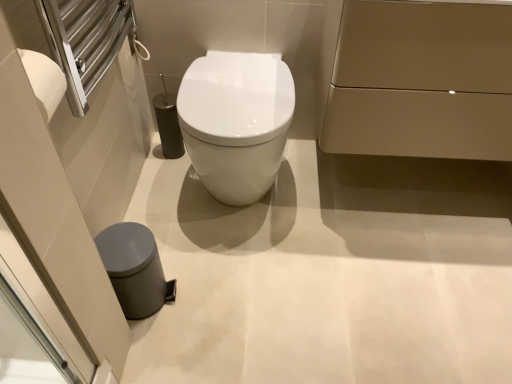
Find the location of a particular element. matte gold cabinet at upper right, acting as the second porcelain starting from the bottom is located at coordinates (419, 79).

How much space does matte gold cabinet at upper right, positioned as the 1th porcelain in right-to-left order, occupy horizontally?

matte gold cabinet at upper right, positioned as the 1th porcelain in right-to-left order, is 44.54 centimeters in width.

Where is `matte gold cabinet at upper right, positioned as the 1th porcelain in right-to-left order`? The height and width of the screenshot is (384, 512). matte gold cabinet at upper right, positioned as the 1th porcelain in right-to-left order is located at coordinates (419, 79).

How different are the orientations of gray matte trash can at lower left, the 1th porcelain viewed from the left, and white glossy toilet at center in degrees?

There is a 89.5-degree angle between the facing directions of gray matte trash can at lower left, the 1th porcelain viewed from the left, and white glossy toilet at center.

Do you think gray matte trash can at lower left, the second porcelain when ordered from right to left, is within white glossy toilet at center, or outside of it?

gray matte trash can at lower left, the second porcelain when ordered from right to left, is not inside white glossy toilet at center, it's outside.

The height and width of the screenshot is (384, 512). I want to click on toilet above the gray matte trash can at lower left, the 1th porcelain viewed from the left (from the image's perspective), so click(236, 121).

Is gray matte trash can at lower left, which is the 1th porcelain from bottom to top, bigger than white glossy toilet at center?

Actually, gray matte trash can at lower left, which is the 1th porcelain from bottom to top, might be smaller than white glossy toilet at center.

Does white glossy toilet at center lie behind gray matte trash can at lower left, the second porcelain when ordered from right to left?

Yes, it is.

Is gray matte trash can at lower left, arranged as the second porcelain when viewed from the top, surrounded by white glossy toilet at center?

That's incorrect, gray matte trash can at lower left, arranged as the second porcelain when viewed from the top, is not inside white glossy toilet at center.

Is white glossy toilet at center not close to gray matte trash can at lower left, arranged as the second porcelain when viewed from the top?

No, white glossy toilet at center is in close proximity to gray matte trash can at lower left, arranged as the second porcelain when viewed from the top.

In terms of height, does white glossy toilet at center look taller or shorter compared to gray matte trash can at lower left, arranged as the second porcelain when viewed from the top?

Clearly, white glossy toilet at center is taller compared to gray matte trash can at lower left, arranged as the second porcelain when viewed from the top.

From the image's perspective, is white glossy toilet at center located above matte gold cabinet at upper right, acting as the 1th porcelain starting from the top?

Incorrect, from the image's perspective, white glossy toilet at center is lower than matte gold cabinet at upper right, acting as the 1th porcelain starting from the top.

Is point (234, 86) closer or farther from the camera than point (457, 143)?

Point (234, 86) is positioned farther from the camera compared to point (457, 143).

From their relative heights in the image, would you say white glossy toilet at center is taller or shorter than matte gold cabinet at upper right, positioned as the 1th porcelain in right-to-left order?

white glossy toilet at center is shorter than matte gold cabinet at upper right, positioned as the 1th porcelain in right-to-left order.

Choose the correct answer: Is white glossy toilet at center inside matte gold cabinet at upper right, acting as the 1th porcelain starting from the top, or outside it?

white glossy toilet at center is not inside matte gold cabinet at upper right, acting as the 1th porcelain starting from the top, it's outside.

Is matte gold cabinet at upper right, positioned as the 1th porcelain in right-to-left order, looking in the opposite direction of gray matte trash can at lower left, the 1th porcelain viewed from the left?

No, matte gold cabinet at upper right, positioned as the 1th porcelain in right-to-left order,'s orientation is not away from gray matte trash can at lower left, the 1th porcelain viewed from the left.

Who is bigger, matte gold cabinet at upper right, positioned as the 1th porcelain in right-to-left order, or gray matte trash can at lower left, the 1th porcelain viewed from the left?

Bigger between the two is matte gold cabinet at upper right, positioned as the 1th porcelain in right-to-left order.

Visually, is matte gold cabinet at upper right, acting as the 1th porcelain starting from the top, positioned to the left or to the right of gray matte trash can at lower left, the 1th porcelain viewed from the left?

matte gold cabinet at upper right, acting as the 1th porcelain starting from the top, is positioned on gray matte trash can at lower left, the 1th porcelain viewed from the left,'s right side.

What are the coordinates of `porcelain in front of the gray matte trash can at lower left, arranged as the second porcelain when viewed from the top` in the screenshot? It's located at (419, 79).

From the image's perspective, is gray matte trash can at lower left, the second porcelain when ordered from right to left, below matte gold cabinet at upper right, acting as the 1th porcelain starting from the top?

Indeed, from the image's perspective, gray matte trash can at lower left, the second porcelain when ordered from right to left, is shown beneath matte gold cabinet at upper right, acting as the 1th porcelain starting from the top.

Is gray matte trash can at lower left, the second porcelain when ordered from right to left, surrounding matte gold cabinet at upper right, acting as the second porcelain starting from the bottom?

No, matte gold cabinet at upper right, acting as the second porcelain starting from the bottom, is not surrounded by gray matte trash can at lower left, the second porcelain when ordered from right to left.

Looking at their sizes, would you say gray matte trash can at lower left, the 1th porcelain viewed from the left, is wider or thinner than matte gold cabinet at upper right, acting as the second porcelain starting from the bottom?

In the image, gray matte trash can at lower left, the 1th porcelain viewed from the left, appears to be more narrow than matte gold cabinet at upper right, acting as the second porcelain starting from the bottom.

From a real-world perspective, who is located lower, gray matte trash can at lower left, arranged as the second porcelain when viewed from the top, or matte gold cabinet at upper right, acting as the 1th porcelain starting from the top?

From a 3D spatial view, gray matte trash can at lower left, arranged as the second porcelain when viewed from the top, is below.

From a real-world perspective, does matte gold cabinet at upper right, acting as the 1th porcelain starting from the top, stand above white glossy toilet at center?

Yes, from a real-world perspective, matte gold cabinet at upper right, acting as the 1th porcelain starting from the top, is above white glossy toilet at center.

Which is nearer, (477, 120) or (244, 132)?

Positioned in front is point (244, 132).

From the picture: From the image's perspective, between matte gold cabinet at upper right, acting as the second porcelain starting from the bottom, and white glossy toilet at center, who is located below?

white glossy toilet at center, from the image's perspective.

The width and height of the screenshot is (512, 384). I want to click on porcelain above the white glossy toilet at center (from the image's perspective), so click(419, 79).

Locate an element on the screen. toilet that appears on the right of gray matte trash can at lower left, the second porcelain when ordered from right to left is located at coordinates (236, 121).

Where is `toilet that is behind the gray matte trash can at lower left, arranged as the second porcelain when viewed from the top`? This screenshot has width=512, height=384. toilet that is behind the gray matte trash can at lower left, arranged as the second porcelain when viewed from the top is located at coordinates (236, 121).

Considering their positions, is matte gold cabinet at upper right, the 2th porcelain from the left, positioned closer to white glossy toilet at center than gray matte trash can at lower left, the 1th porcelain viewed from the left?

The object closer to white glossy toilet at center is matte gold cabinet at upper right, the 2th porcelain from the left.

When comparing their distances from matte gold cabinet at upper right, the 2th porcelain from the left, does gray matte trash can at lower left, which is the 1th porcelain from bottom to top, or white glossy toilet at center seem further?

gray matte trash can at lower left, which is the 1th porcelain from bottom to top, lies further to matte gold cabinet at upper right, the 2th porcelain from the left, than the other object.

Based on their spatial positions, is gray matte trash can at lower left, which is the 1th porcelain from bottom to top, or matte gold cabinet at upper right, the 2th porcelain from the left, closer to white glossy toilet at center?

matte gold cabinet at upper right, the 2th porcelain from the left, lies closer to white glossy toilet at center than the other object.

Estimate the real-world distances between objects in this image. Which object is closer to matte gold cabinet at upper right, acting as the 1th porcelain starting from the top, white glossy toilet at center or gray matte trash can at lower left, the 1th porcelain viewed from the left?

white glossy toilet at center is positioned closer to the anchor matte gold cabinet at upper right, acting as the 1th porcelain starting from the top.

When comparing their distances from gray matte trash can at lower left, the 1th porcelain viewed from the left, does white glossy toilet at center or matte gold cabinet at upper right, positioned as the 1th porcelain in right-to-left order, seem closer?

white glossy toilet at center is positioned closer to the anchor gray matte trash can at lower left, the 1th porcelain viewed from the left.

Estimate the real-world distances between objects in this image. Which object is further from gray matte trash can at lower left, which is the 1th porcelain from bottom to top, matte gold cabinet at upper right, positioned as the 1th porcelain in right-to-left order, or white glossy toilet at center?

The object further to gray matte trash can at lower left, which is the 1th porcelain from bottom to top, is matte gold cabinet at upper right, positioned as the 1th porcelain in right-to-left order.

You are a GUI agent. You are given a task and a screenshot of the screen. Output one action in this format:
    pyautogui.click(x=<x>, y=<y>)
    Task: Click on the toilet between gray matte trash can at lower left, which is the 1th porcelain from bottom to top, and matte gold cabinet at upper right, the 2th porcelain from the left
    This screenshot has width=512, height=384.
    Given the screenshot: What is the action you would take?
    pyautogui.click(x=236, y=121)